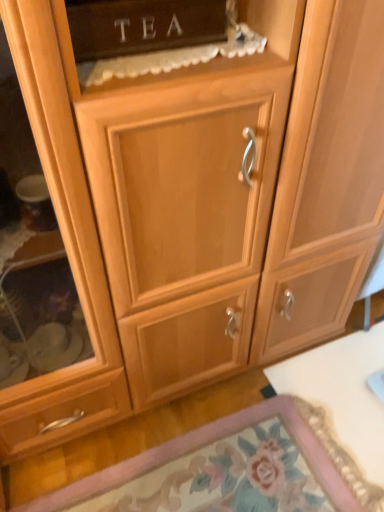
Question: From a real-world perspective, is wooden cabinet door at lower center on top of white glossy table at lower right?

Choices:
 (A) no
 (B) yes

Answer: (A)

Question: Would you say wooden cabinet door at lower center contains white glossy table at lower right?

Choices:
 (A) yes
 (B) no

Answer: (B)

Question: Is wooden cabinet door at lower center shorter than white glossy table at lower right?

Choices:
 (A) yes
 (B) no

Answer: (A)

Question: Is wooden cabinet door at lower center oriented towards white glossy table at lower right?

Choices:
 (A) yes
 (B) no

Answer: (A)

Question: Considering the relative sizes of wooden cabinet door at lower center and white glossy table at lower right in the image provided, is wooden cabinet door at lower center smaller than white glossy table at lower right?

Choices:
 (A) yes
 (B) no

Answer: (B)

Question: Does wooden cabinet door at lower center appear on the left side of white glossy table at lower right?

Choices:
 (A) no
 (B) yes

Answer: (B)

Question: Is matte wood tea cabinet at upper center outside wooden cabinet door at lower center?

Choices:
 (A) no
 (B) yes

Answer: (B)

Question: Are matte wood tea cabinet at upper center and wooden cabinet door at lower center beside each other?

Choices:
 (A) yes
 (B) no

Answer: (B)

Question: Can you confirm if matte wood tea cabinet at upper center is taller than wooden cabinet door at lower center?

Choices:
 (A) no
 (B) yes

Answer: (B)

Question: From a real-world perspective, does matte wood tea cabinet at upper center sit lower than wooden cabinet door at lower center?

Choices:
 (A) yes
 (B) no

Answer: (B)

Question: Is matte wood tea cabinet at upper center far away from wooden cabinet door at lower center?

Choices:
 (A) no
 (B) yes

Answer: (B)

Question: Is matte wood tea cabinet at upper center oriented away from wooden cabinet door at lower center?

Choices:
 (A) yes
 (B) no

Answer: (B)

Question: Is white glossy table at lower right smaller than wooden cabinet door at lower center?

Choices:
 (A) yes
 (B) no

Answer: (A)